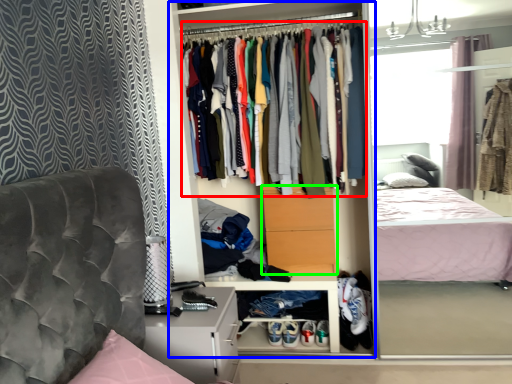
Question: Estimate the real-world distances between objects in this image. Which object is farther from clothing (highlighted by a red box), dresser (highlighted by a blue box) or drawer (highlighted by a green box)?

Choices:
 (A) dresser
 (B) drawer

Answer: (A)